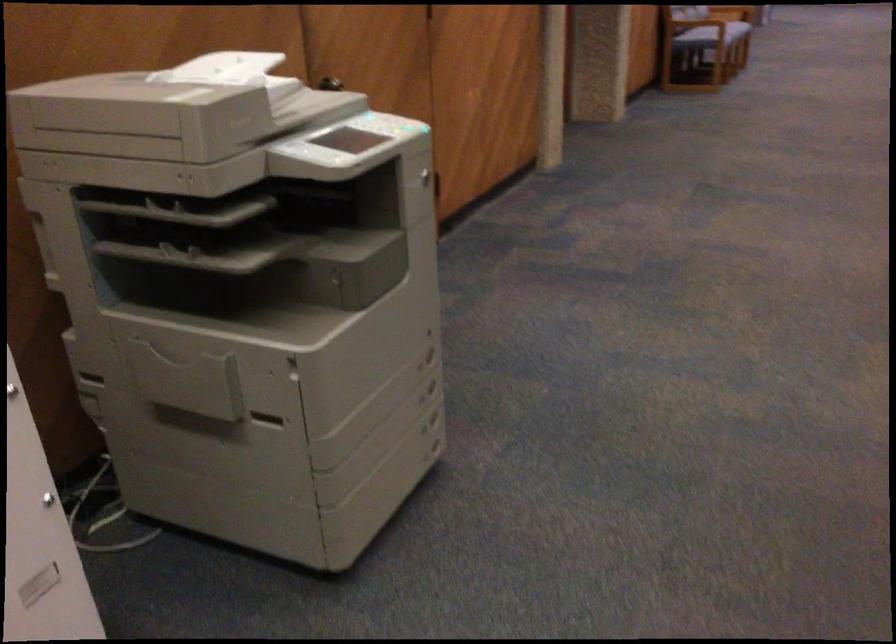
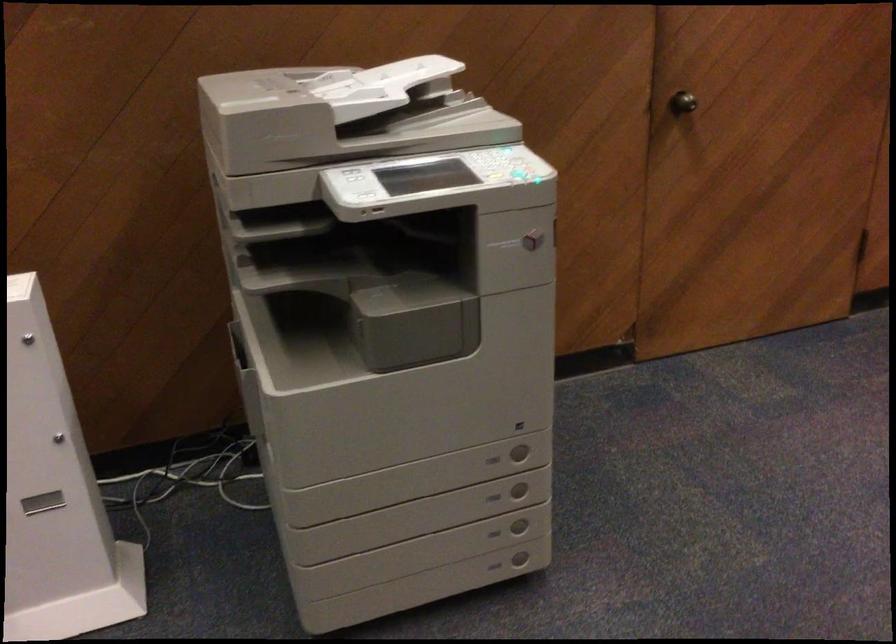
Locate, in the second image, the point that corresponds to point 342,84 in the first image.

(682, 102)